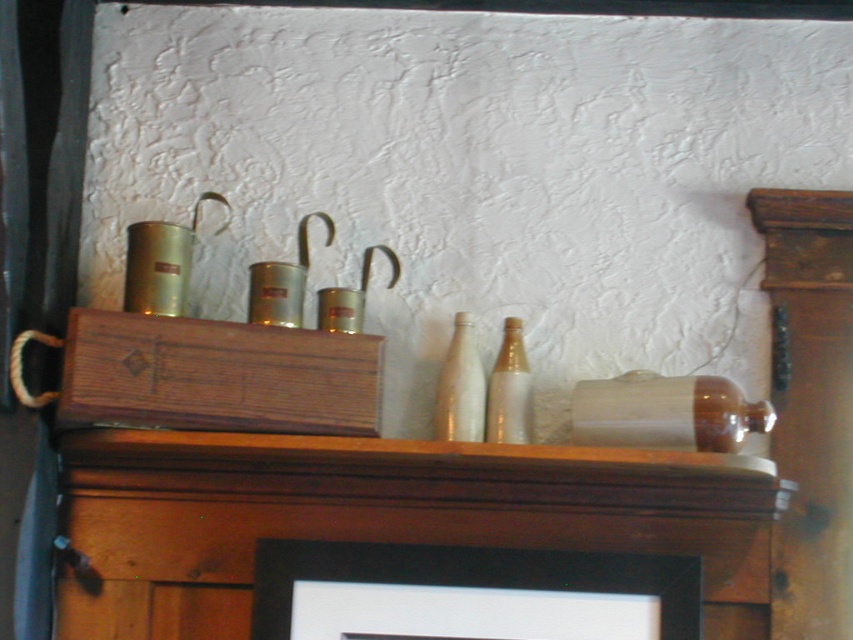
Does transparent glass bottle at center have a lesser width compared to translucent glass bottle at center?

No.

Is point (618, 417) in front of point (508, 317)?

Yes.

Identify the location of transparent glass bottle at center. This screenshot has height=640, width=853. (666, 412).

In the scene shown: Which is more to the right, wooden at center or black matte picture frame at upper center?

black matte picture frame at upper center

Is wooden at center further to the viewer compared to black matte picture frame at upper center?

No, wooden at center is in front of black matte picture frame at upper center.

Is point (126, 625) closer to viewer compared to point (325, 548)?

Yes, point (126, 625) is closer to viewer.

Locate an element on the screen. wooden at center is located at coordinates (381, 515).

Can you confirm if white glass bottle at center is wider than translucent glass bottle at center?

Yes.

Does point (460, 364) come in front of point (508, 365)?

Yes, it is in front of point (508, 365).

This screenshot has height=640, width=853. Identify the location of white glass bottle at center. (460, 387).